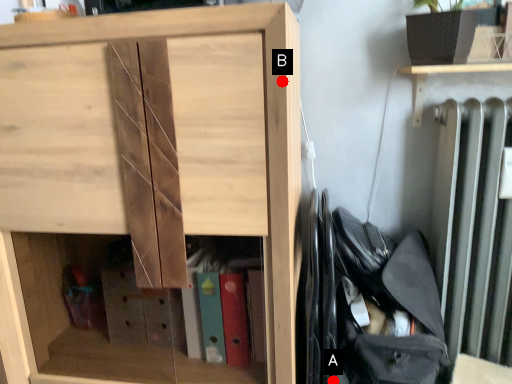
Question: Two points are circled on the image, labeled by A and B beside each circle. Which point is closer to the camera?

Choices:
 (A) A is closer
 (B) B is closer

Answer: (B)